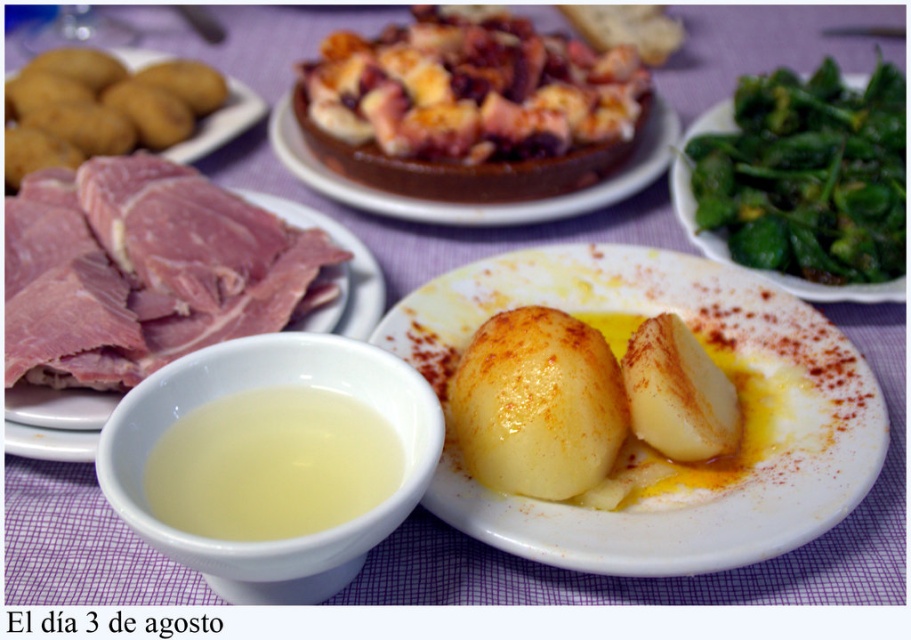
Does green smooth vegetable at upper right have a greater height compared to yellow matte potato at center?

Indeed, green smooth vegetable at upper right has a greater height compared to yellow matte potato at center.

Does green smooth vegetable at upper right have a smaller size compared to yellow matte potato at center?

Actually, green smooth vegetable at upper right might be larger than yellow matte potato at center.

This screenshot has height=640, width=911. What do you see at coordinates (807, 176) in the screenshot? I see `green smooth vegetable at upper right` at bounding box center [807, 176].

Image resolution: width=911 pixels, height=640 pixels. What are the coordinates of `green smooth vegetable at upper right` in the screenshot? It's located at (807, 176).

Between smooth yellow potatoes at center and green smooth vegetable at upper right, which one is positioned lower?

smooth yellow potatoes at center

Between point (806, 476) and point (869, 205), which one is positioned in front?

Point (806, 476)

Does point (807, 522) come closer to viewer compared to point (899, 209)?

Yes, point (807, 522) is closer to viewer.

Where is `smooth yellow potatoes at center`? This screenshot has width=911, height=640. smooth yellow potatoes at center is located at coordinates click(646, 448).

Does smooth yellow potatoes at center have a lesser height compared to translucent white bowl at lower left?

No, smooth yellow potatoes at center is not shorter than translucent white bowl at lower left.

Image resolution: width=911 pixels, height=640 pixels. Describe the element at coordinates (646, 448) in the screenshot. I see `smooth yellow potatoes at center` at that location.

This screenshot has width=911, height=640. In order to click on smooth yellow potatoes at center in this screenshot , I will do `click(646, 448)`.